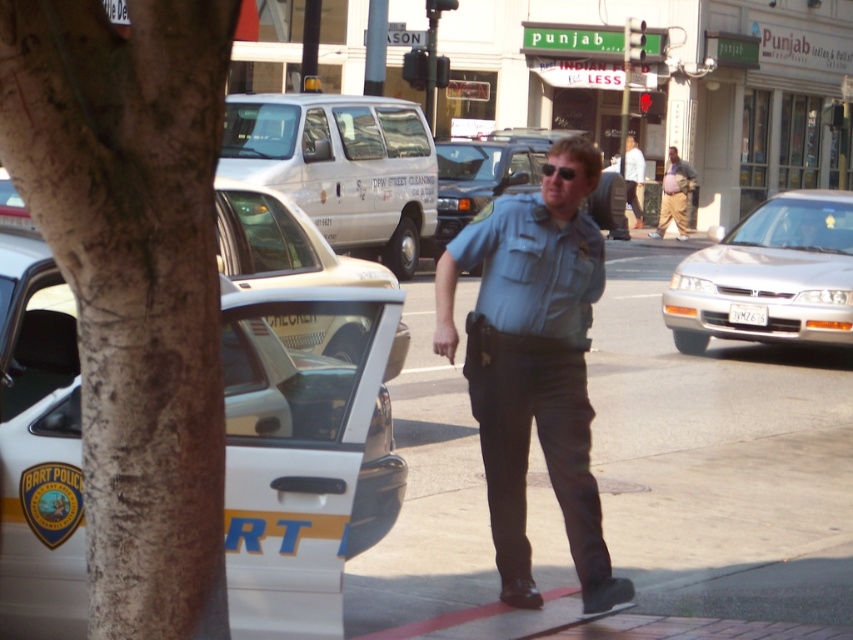
Question: Does light blue uniform at center have a greater width compared to brown cotton pants at center?

Choices:
 (A) yes
 (B) no

Answer: (B)

Question: Estimate the real-world distances between objects in this image. Which object is closer to the metallic silver taxi at center?

Choices:
 (A) white glossy taxi at left
 (B) black plastic sunglasses at center
 (C) silver metallic sedan at center-right
 (D) white matte van at center

Answer: (A)

Question: Is brown cotton pants at center positioned in front of black plastic sunglasses at center?

Choices:
 (A) no
 (B) yes

Answer: (A)

Question: Estimate the real-world distances between objects in this image. Which object is farther from the black plastic sunglasses at center?

Choices:
 (A) silver metallic sedan at center-right
 (B) white shirt at center

Answer: (A)

Question: Is smooth asphalt at center thinner than metallic silver taxi at center?

Choices:
 (A) no
 (B) yes

Answer: (A)

Question: Estimate the real-world distances between objects in this image. Which object is closer to the silver metallic sedan at center-right?

Choices:
 (A) light blue uniform at center
 (B) black plastic sunglasses at center
 (C) brown cotton pants at center

Answer: (A)